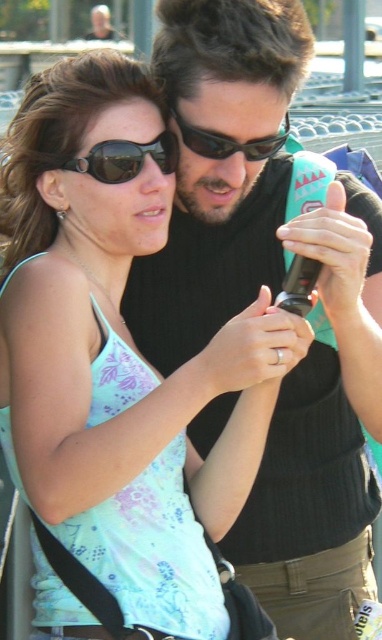
Question: Which point is farther to the camera?

Choices:
 (A) sunglasses at center
 (B) matte black sunglasses at upper left

Answer: (A)

Question: Can you confirm if matte black sunglasses at upper left is positioned to the right of sunglasses at center?

Choices:
 (A) no
 (B) yes

Answer: (A)

Question: Can you confirm if matte black sunglasses at upper left is positioned to the left of sunglasses at center?

Choices:
 (A) yes
 (B) no

Answer: (A)

Question: Among these objects, which one is nearest to the camera?

Choices:
 (A) sunglasses at center
 (B) matte black sunglasses at upper left

Answer: (B)

Question: Which point is closer to the camera taking this photo?

Choices:
 (A) (171, 154)
 (B) (210, 140)

Answer: (B)

Question: Is the position of matte black sunglasses at upper left more distant than that of sunglasses at center?

Choices:
 (A) no
 (B) yes

Answer: (A)